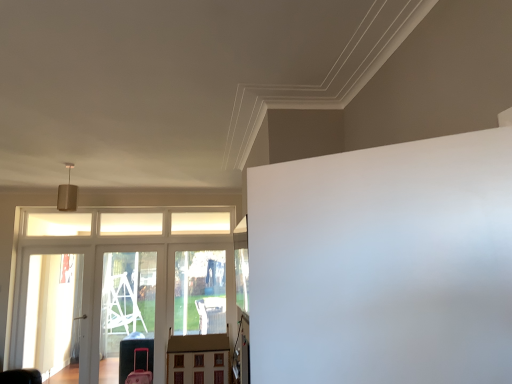
Measure the distance between point (31, 216) and camera.

They are 5.48 meters apart.

The height and width of the screenshot is (384, 512). What are the coordinates of `transparent plastic screen door at left, which is the second screen door from left to right` in the screenshot? It's located at (128, 310).

Locate an element on the screen. The height and width of the screenshot is (384, 512). wooden dollhouse at center is located at coordinates (198, 359).

At what (x,y) coordinates should I click in order to perform the action: click on transparent glass screen door at left, the 2th screen door in the right-to-left sequence. Please return your answer as a coordinate pair (x, y). Looking at the image, I should click on (53, 312).

Which of these two, transparent glass screen door at left, which is counted as the first screen door, starting from the left, or transparent plastic screen door at left, which ranks as the first screen door in right-to-left order, is wider?

transparent plastic screen door at left, which ranks as the first screen door in right-to-left order, is wider.

Is transparent glass screen door at left, the 2th screen door in the right-to-left sequence, outside of transparent plastic screen door at left, which ranks as the first screen door in right-to-left order?

transparent glass screen door at left, the 2th screen door in the right-to-left sequence, is positioned outside transparent plastic screen door at left, which ranks as the first screen door in right-to-left order.

Is there a large distance between transparent glass screen door at left, which is counted as the first screen door, starting from the left, and transparent plastic screen door at left, which ranks as the first screen door in right-to-left order?

That's not correct — transparent glass screen door at left, which is counted as the first screen door, starting from the left, is a little close to transparent plastic screen door at left, which ranks as the first screen door in right-to-left order.

From the image's perspective, between transparent glass screen door at left, which is counted as the first screen door, starting from the left, and transparent plastic screen door at left, which ranks as the first screen door in right-to-left order, who is located below?

transparent plastic screen door at left, which ranks as the first screen door in right-to-left order, is shown below in the image.

Is transparent glass screen door at left, which is counted as the first screen door, starting from the left, not close to transparent plastic elevator at lower left?

Actually, transparent glass screen door at left, which is counted as the first screen door, starting from the left, and transparent plastic elevator at lower left are a little close together.

Find the location of `screen door on the left of the transparent plastic elevator at lower left`. screen door on the left of the transparent plastic elevator at lower left is located at coordinates (53, 312).

Does point (70, 267) come in front of point (150, 288)?

Yes, it is in front of point (150, 288).

Considering the relative sizes of transparent glass screen door at left, the 2th screen door in the right-to-left sequence, and transparent plastic elevator at lower left in the image provided, is transparent glass screen door at left, the 2th screen door in the right-to-left sequence, shorter than transparent plastic elevator at lower left?

Indeed, transparent glass screen door at left, the 2th screen door in the right-to-left sequence, has a lesser height compared to transparent plastic elevator at lower left.

Does transparent plastic screen door at left, which ranks as the first screen door in right-to-left order, turn towards transparent glass screen door at left, the 2th screen door in the right-to-left sequence?

No, transparent plastic screen door at left, which ranks as the first screen door in right-to-left order, is not oriented towards transparent glass screen door at left, the 2th screen door in the right-to-left sequence.

Which of these two, transparent plastic screen door at left, which ranks as the first screen door in right-to-left order, or transparent glass screen door at left, the 2th screen door in the right-to-left sequence, is smaller?

With smaller size is transparent glass screen door at left, the 2th screen door in the right-to-left sequence.

From a real-world perspective, which object stands above the other?

transparent glass screen door at left, which is counted as the first screen door, starting from the left.

Which object is wider, transparent plastic screen door at left, which is the second screen door from left to right, or transparent glass screen door at left, which is counted as the first screen door, starting from the left?

With larger width is transparent plastic screen door at left, which is the second screen door from left to right.

In terms of width, does wooden dollhouse at center look wider or thinner when compared to transparent plastic screen door at left, which ranks as the first screen door in right-to-left order?

In the image, wooden dollhouse at center appears to be wider than transparent plastic screen door at left, which ranks as the first screen door in right-to-left order.

Based on the photo, does wooden dollhouse at center contain transparent plastic screen door at left, which ranks as the first screen door in right-to-left order?

Definitely not — transparent plastic screen door at left, which ranks as the first screen door in right-to-left order, is not inside wooden dollhouse at center.

Considering the positions of point (178, 342) and point (145, 272), is point (178, 342) closer or farther from the camera than point (145, 272)?

Point (178, 342) appears to be closer to the viewer than point (145, 272).

Considering the sizes of wooden dollhouse at center and transparent plastic screen door at left, which ranks as the first screen door in right-to-left order, in the image, is wooden dollhouse at center taller or shorter than transparent plastic screen door at left, which ranks as the first screen door in right-to-left order,?

Considering their sizes, wooden dollhouse at center has less height than transparent plastic screen door at left, which ranks as the first screen door in right-to-left order.

Is transparent plastic screen door at left, which ranks as the first screen door in right-to-left order, aimed at transparent plastic elevator at lower left?

Yes.

From their relative heights in the image, would you say transparent plastic screen door at left, which is the second screen door from left to right, is taller or shorter than transparent plastic elevator at lower left?

Clearly, transparent plastic screen door at left, which is the second screen door from left to right, is shorter compared to transparent plastic elevator at lower left.

Considering the positions of objects transparent plastic screen door at left, which is the second screen door from left to right, and transparent plastic elevator at lower left in the image provided, who is more to the left, transparent plastic screen door at left, which is the second screen door from left to right, or transparent plastic elevator at lower left?

Positioned to the left is transparent plastic elevator at lower left.

Does point (120, 362) come in front of point (132, 313)?

Yes, point (120, 362) is closer to viewer.

From the image's perspective, relative to wooden dollhouse at center, is transparent plastic screen door at left, which ranks as the first screen door in right-to-left order, above or below?

From the image's perspective, transparent plastic screen door at left, which ranks as the first screen door in right-to-left order, appears above wooden dollhouse at center.

Is transparent plastic screen door at left, which ranks as the first screen door in right-to-left order, looking in the opposite direction of wooden dollhouse at center?

No.

From a real-world perspective, relative to wooden dollhouse at center, is transparent plastic screen door at left, which is the second screen door from left to right, vertically above or below?

Clearly, from a real-world perspective, transparent plastic screen door at left, which is the second screen door from left to right, is above wooden dollhouse at center.

Which object is further away from the camera taking this photo, transparent plastic screen door at left, which ranks as the first screen door in right-to-left order, or wooden dollhouse at center?

transparent plastic screen door at left, which ranks as the first screen door in right-to-left order, is further away from the camera.

Find the location of a particular element. This screenshot has width=512, height=384. elevator located behind the wooden dollhouse at center is located at coordinates (117, 284).

Considering the relative sizes of wooden dollhouse at center and transparent plastic elevator at lower left in the image provided, is wooden dollhouse at center shorter than transparent plastic elevator at lower left?

Indeed, wooden dollhouse at center has a lesser height compared to transparent plastic elevator at lower left.

In terms of width, does wooden dollhouse at center look wider or thinner when compared to transparent plastic elevator at lower left?

wooden dollhouse at center is wider than transparent plastic elevator at lower left.

Does wooden dollhouse at center have a larger size compared to transparent plastic elevator at lower left?

No, wooden dollhouse at center is not bigger than transparent plastic elevator at lower left.

This screenshot has height=384, width=512. I want to click on screen door behind the transparent glass screen door at left, the 2th screen door in the right-to-left sequence, so click(x=128, y=310).

This screenshot has width=512, height=384. Identify the location of elevator above the transparent glass screen door at left, which is counted as the first screen door, starting from the left (from a real-world perspective). (117, 284).

Estimate the real-world distances between objects in this image. Which object is further from transparent glass screen door at left, the 2th screen door in the right-to-left sequence, transparent plastic screen door at left, which ranks as the first screen door in right-to-left order, or transparent plastic elevator at lower left?

transparent plastic screen door at left, which ranks as the first screen door in right-to-left order, is positioned further to the anchor transparent glass screen door at left, the 2th screen door in the right-to-left sequence.

Looking at the image, which one is located closer to transparent glass screen door at left, which is counted as the first screen door, starting from the left, transparent plastic elevator at lower left or wooden dollhouse at center?

Among the two, transparent plastic elevator at lower left is located nearer to transparent glass screen door at left, which is counted as the first screen door, starting from the left.

In the scene shown: From the image, which object appears to be nearer to transparent plastic screen door at left, which ranks as the first screen door in right-to-left order, wooden dollhouse at center or transparent plastic elevator at lower left?

transparent plastic elevator at lower left is positioned closer to the anchor transparent plastic screen door at left, which ranks as the first screen door in right-to-left order.

Looking at the image, which one is located closer to transparent plastic screen door at left, which ranks as the first screen door in right-to-left order, transparent plastic elevator at lower left or wooden dollhouse at center?

Based on the image, transparent plastic elevator at lower left appears to be nearer to transparent plastic screen door at left, which ranks as the first screen door in right-to-left order.

Considering their positions, is wooden dollhouse at center positioned closer to transparent plastic screen door at left, which is the second screen door from left to right, than transparent glass screen door at left, which is counted as the first screen door, starting from the left?

Among the two, transparent glass screen door at left, which is counted as the first screen door, starting from the left, is located nearer to transparent plastic screen door at left, which is the second screen door from left to right.

Estimate the real-world distances between objects in this image. Which object is closer to transparent plastic elevator at lower left, transparent glass screen door at left, the 2th screen door in the right-to-left sequence, or wooden dollhouse at center?

Among the two, transparent glass screen door at left, the 2th screen door in the right-to-left sequence, is located nearer to transparent plastic elevator at lower left.

When comparing their distances from transparent plastic elevator at lower left, does wooden dollhouse at center or transparent glass screen door at left, the 2th screen door in the right-to-left sequence, seem closer?

The object closer to transparent plastic elevator at lower left is transparent glass screen door at left, the 2th screen door in the right-to-left sequence.

Looking at the image, which one is located further to wooden dollhouse at center, transparent glass screen door at left, the 2th screen door in the right-to-left sequence, or transparent plastic elevator at lower left?

transparent glass screen door at left, the 2th screen door in the right-to-left sequence, is further to wooden dollhouse at center.

Where is `screen door between transparent plastic elevator at lower left and wooden dollhouse at center in the horizontal direction`? screen door between transparent plastic elevator at lower left and wooden dollhouse at center in the horizontal direction is located at coordinates (128, 310).

What are the coordinates of `screen door between transparent glass screen door at left, the 2th screen door in the right-to-left sequence, and wooden dollhouse at center` in the screenshot? It's located at (128, 310).

You are a GUI agent. You are given a task and a screenshot of the screen. Output one action in this format:
    pyautogui.click(x=<x>, y=<y>)
    Task: Click on the elevator situated between transparent glass screen door at left, which is counted as the first screen door, starting from the left, and wooden dollhouse at center from left to right
    The height and width of the screenshot is (384, 512).
    Given the screenshot: What is the action you would take?
    pyautogui.click(x=117, y=284)

The width and height of the screenshot is (512, 384). What are the coordinates of `elevator between transparent glass screen door at left, which is counted as the first screen door, starting from the left, and transparent plastic screen door at left, which is the second screen door from left to right` in the screenshot? It's located at (117, 284).